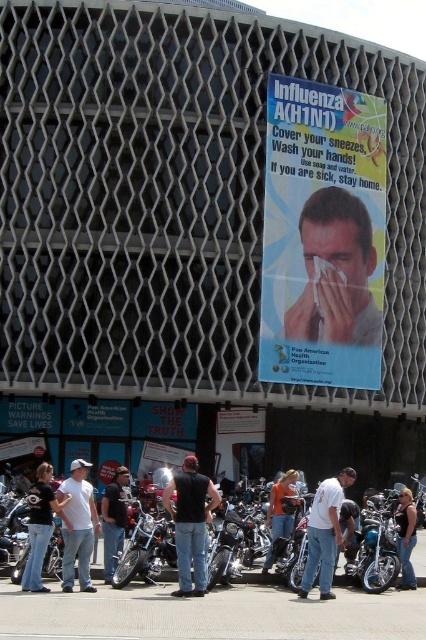
Question: Which of these objects is positioned closest to the blue paper poster at center?

Choices:
 (A) denim jacket at lower left
 (B) orange fabric shirt at center
 (C) polished chrome motorcycle at lower center

Answer: (B)

Question: Is black matte vest at center positioned before white cotton shirt at lower center?

Choices:
 (A) yes
 (B) no

Answer: (A)

Question: Which object is farther from the camera taking this photo?

Choices:
 (A) polished chrome motorcycle at lower center
 (B) blue paper poster at center
 (C) white cotton shirt at lower left

Answer: (B)

Question: Is smooth skin face at center further to the viewer compared to polished chrome motorcycle at lower center?

Choices:
 (A) no
 (B) yes

Answer: (B)

Question: Is black matte vest at center behind white cotton shirt at lower left?

Choices:
 (A) no
 (B) yes

Answer: (B)

Question: Which is nearer to the polished chrome motorcycle at lower center?

Choices:
 (A) smooth skin face at center
 (B) denim jeans at lower left
 (C) white cotton shirt at lower left
 (D) blue paper poster at center

Answer: (C)